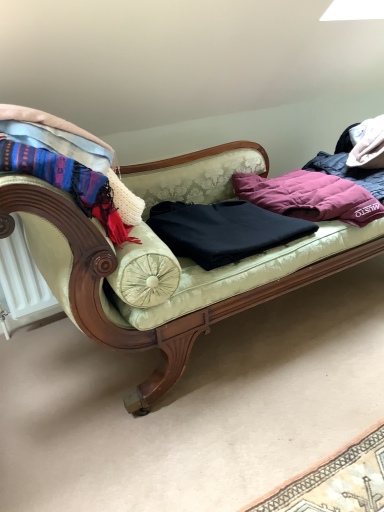
Consider the image. What is the approximate width of velvet green couch at center?

velvet green couch at center is 30.88 inches in width.

Consider the image. Measure the distance between point (276, 224) and camera.

A distance of 1.55 meters exists between point (276, 224) and camera.

Identify the location of purple down jacket at center, positioned as the 1th clothing in right-to-left order. This screenshot has width=384, height=512. (310, 196).

Image resolution: width=384 pixels, height=512 pixels. I want to click on knitted wool scarf at left, so click(74, 159).

Image resolution: width=384 pixels, height=512 pixels. I want to click on velvet green couch at center, so click(162, 311).

Is black matte sweater at center, placed as the second clothing when sorted from right to left, turned away from knitted wool scarf at left?

No, black matte sweater at center, placed as the second clothing when sorted from right to left, is not facing the opposite direction of knitted wool scarf at left.

Can you confirm if black matte sweater at center, placed as the second clothing when sorted from right to left, is taller than knitted wool scarf at left?

No, black matte sweater at center, placed as the second clothing when sorted from right to left, is not taller than knitted wool scarf at left.

From a real-world perspective, which is physically above, black matte sweater at center, the first clothing positioned from the left, or knitted wool scarf at left?

knitted wool scarf at left.

Considering the positions of objects purple down jacket at center, positioned as the 1th clothing in right-to-left order, and black matte sweater at center, the first clothing positioned from the left, in the image provided, who is more to the left, purple down jacket at center, positioned as the 1th clothing in right-to-left order, or black matte sweater at center, the first clothing positioned from the left,?

black matte sweater at center, the first clothing positioned from the left, is more to the left.

From the image's perspective, would you say purple down jacket at center, positioned as the 1th clothing in right-to-left order, is positioned over black matte sweater at center, placed as the second clothing when sorted from right to left?

Indeed, from the image's perspective, purple down jacket at center, positioned as the 1th clothing in right-to-left order, is shown above black matte sweater at center, placed as the second clothing when sorted from right to left.

What's the angular difference between purple down jacket at center, marked as the 2th clothing in a left-to-right arrangement, and black matte sweater at center, placed as the second clothing when sorted from right to left,'s facing directions?

0.000202 degrees separate the facing orientations of purple down jacket at center, marked as the 2th clothing in a left-to-right arrangement, and black matte sweater at center, placed as the second clothing when sorted from right to left.

Where is `studio couch in front of the knitted wool scarf at left`? The height and width of the screenshot is (512, 384). studio couch in front of the knitted wool scarf at left is located at coordinates (162, 311).

Is velvet green couch at center oriented towards knitted wool scarf at left?

No, velvet green couch at center is not facing towards knitted wool scarf at left.

In the scene shown: Which is more to the left, velvet green couch at center or knitted wool scarf at left?

knitted wool scarf at left is more to the left.

From the image's perspective, does black matte sweater at center, the first clothing positioned from the left, appear lower than purple down jacket at center, marked as the 2th clothing in a left-to-right arrangement?

Yes, from the image's perspective, black matte sweater at center, the first clothing positioned from the left, is beneath purple down jacket at center, marked as the 2th clothing in a left-to-right arrangement.

Which of these two, black matte sweater at center, the first clothing positioned from the left, or purple down jacket at center, positioned as the 1th clothing in right-to-left order, is wider?

purple down jacket at center, positioned as the 1th clothing in right-to-left order.

The width and height of the screenshot is (384, 512). I want to click on clothing lying on the left of purple down jacket at center, positioned as the 1th clothing in right-to-left order, so click(x=223, y=230).

Is there a large distance between black matte sweater at center, the first clothing positioned from the left, and purple down jacket at center, positioned as the 1th clothing in right-to-left order?

black matte sweater at center, the first clothing positioned from the left, is actually quite close to purple down jacket at center, positioned as the 1th clothing in right-to-left order.

In the image, is knitted wool scarf at left positioned in front of or behind velvet green couch at center?

Visually, knitted wool scarf at left is located behind velvet green couch at center.

Consider the image. From a real-world perspective, is knitted wool scarf at left physically below velvet green couch at center?

No, from a real-world perspective, knitted wool scarf at left is not beneath velvet green couch at center.

Who is smaller, knitted wool scarf at left or velvet green couch at center?

knitted wool scarf at left.

Looking at their sizes, would you say purple down jacket at center, positioned as the 1th clothing in right-to-left order, is wider or thinner than knitted wool scarf at left?

Clearly, purple down jacket at center, positioned as the 1th clothing in right-to-left order, has more width compared to knitted wool scarf at left.

From the image's perspective, does purple down jacket at center, marked as the 2th clothing in a left-to-right arrangement, appear higher than knitted wool scarf at left?

Yes, from the image's perspective, purple down jacket at center, marked as the 2th clothing in a left-to-right arrangement, is above knitted wool scarf at left.

Is the surface of purple down jacket at center, positioned as the 1th clothing in right-to-left order, in direct contact with knitted wool scarf at left?

No, purple down jacket at center, positioned as the 1th clothing in right-to-left order, is not making contact with knitted wool scarf at left.

Is purple down jacket at center, positioned as the 1th clothing in right-to-left order, oriented towards knitted wool scarf at left?

No, purple down jacket at center, positioned as the 1th clothing in right-to-left order, is not facing towards knitted wool scarf at left.

From the image's perspective, is velvet green couch at center positioned above or below black matte sweater at center, the first clothing positioned from the left?

velvet green couch at center is situated higher than black matte sweater at center, the first clothing positioned from the left, in the image.

The height and width of the screenshot is (512, 384). I want to click on clothing that appears below the velvet green couch at center (from the image's perspective), so click(223, 230).

Can you confirm if velvet green couch at center is shorter than black matte sweater at center, the first clothing positioned from the left?

Incorrect, the height of velvet green couch at center does not fall short of that of black matte sweater at center, the first clothing positioned from the left.

From a real-world perspective, is velvet green couch at center positioned above or below black matte sweater at center, placed as the second clothing when sorted from right to left?

velvet green couch at center is situated lower than black matte sweater at center, placed as the second clothing when sorted from right to left, in the real world.

You are a GUI agent. You are given a task and a screenshot of the screen. Output one action in this format:
    pyautogui.click(x=<x>, y=<y>)
    Task: Click on the blanket on the left of the black matte sweater at center, placed as the second clothing when sorted from right to left
    The height and width of the screenshot is (512, 384).
    Given the screenshot: What is the action you would take?
    pyautogui.click(x=74, y=159)

Find the location of a particular element. This screenshot has width=384, height=512. clothing behind the black matte sweater at center, placed as the second clothing when sorted from right to left is located at coordinates (310, 196).

Estimate the real-world distances between objects in this image. Which object is closer to knitted wool scarf at left, velvet green couch at center or purple down jacket at center, marked as the 2th clothing in a left-to-right arrangement?

The object closer to knitted wool scarf at left is velvet green couch at center.

From the image, which object appears to be nearer to purple down jacket at center, positioned as the 1th clothing in right-to-left order, velvet green couch at center or black matte sweater at center, the first clothing positioned from the left?

black matte sweater at center, the first clothing positioned from the left, lies closer to purple down jacket at center, positioned as the 1th clothing in right-to-left order, than the other object.

Estimate the real-world distances between objects in this image. Which object is closer to black matte sweater at center, the first clothing positioned from the left, purple down jacket at center, marked as the 2th clothing in a left-to-right arrangement, or velvet green couch at center?

The object closer to black matte sweater at center, the first clothing positioned from the left, is velvet green couch at center.

When comparing their distances from velvet green couch at center, does knitted wool scarf at left or purple down jacket at center, marked as the 2th clothing in a left-to-right arrangement, seem closer?

Based on the image, knitted wool scarf at left appears to be nearer to velvet green couch at center.

From the image, which object appears to be nearer to velvet green couch at center, purple down jacket at center, positioned as the 1th clothing in right-to-left order, or knitted wool scarf at left?

Based on the image, knitted wool scarf at left appears to be nearer to velvet green couch at center.

Which object lies nearer to the anchor point velvet green couch at center, black matte sweater at center, placed as the second clothing when sorted from right to left, or knitted wool scarf at left?

black matte sweater at center, placed as the second clothing when sorted from right to left, lies closer to velvet green couch at center than the other object.

Based on the photo, which object lies nearer to the anchor point knitted wool scarf at left, purple down jacket at center, marked as the 2th clothing in a left-to-right arrangement, or velvet green couch at center?

Based on the image, velvet green couch at center appears to be nearer to knitted wool scarf at left.

Looking at the image, which one is located further to black matte sweater at center, placed as the second clothing when sorted from right to left, velvet green couch at center or purple down jacket at center, marked as the 2th clothing in a left-to-right arrangement?

Among the two, purple down jacket at center, marked as the 2th clothing in a left-to-right arrangement, is located further to black matte sweater at center, placed as the second clothing when sorted from right to left.

Locate an element on the screen. The height and width of the screenshot is (512, 384). studio couch situated between knitted wool scarf at left and purple down jacket at center, marked as the 2th clothing in a left-to-right arrangement, from left to right is located at coordinates (162, 311).

Find the location of a particular element. Image resolution: width=384 pixels, height=512 pixels. clothing located between velvet green couch at center and purple down jacket at center, positioned as the 1th clothing in right-to-left order, in the depth direction is located at coordinates (223, 230).

This screenshot has width=384, height=512. Find the location of `clothing between knitted wool scarf at left and velvet green couch at center from left to right`. clothing between knitted wool scarf at left and velvet green couch at center from left to right is located at coordinates (223, 230).

Locate an element on the screen. This screenshot has height=512, width=384. clothing situated between knitted wool scarf at left and purple down jacket at center, positioned as the 1th clothing in right-to-left order, from left to right is located at coordinates (x=223, y=230).